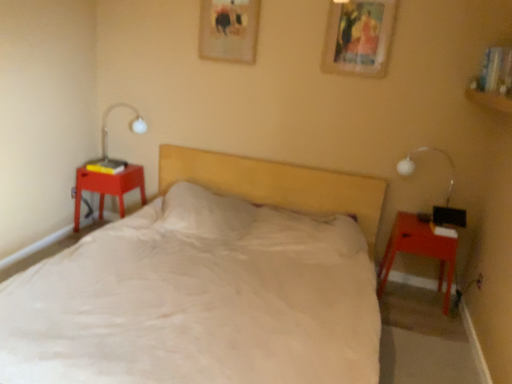
Question: Relative to matte red nightstand at right, which is counted as the 2th nightstand, starting from the back, is matte plastic nightstand at left, which ranks as the first nightstand in left-to-right order, in front or behind?

Choices:
 (A) front
 (B) behind

Answer: (B)

Question: Considering the positions of matte plastic nightstand at left, the 2th nightstand when ordered from right to left, and matte red nightstand at right, marked as the 2th nightstand in a left-to-right arrangement, in the image, is matte plastic nightstand at left, the 2th nightstand when ordered from right to left, bigger or smaller than matte red nightstand at right, marked as the 2th nightstand in a left-to-right arrangement,?

Choices:
 (A) small
 (B) big

Answer: (A)

Question: Estimate the real-world distances between objects in this image. Which object is farther from the white glass bedside lamp at right?

Choices:
 (A) wooden picture frame at upper center, placed as the second picture frame when sorted from left to right
 (B) white soft bed at center
 (C) white glossy table lamp at left
 (D) matte plastic nightstand at left, which ranks as the first nightstand in left-to-right order
 (E) matte red nightstand at right, the first nightstand when ordered from right to left

Answer: (D)

Question: Which object is the closest to the white glossy table lamp at left?

Choices:
 (A) matte plastic nightstand at left, which ranks as the first nightstand in left-to-right order
 (B) wooden picture frame at upper center, arranged as the 2th picture frame when viewed from the back
 (C) white glass bedside lamp at right
 (D) matte red nightstand at right, marked as the 2th nightstand in a left-to-right arrangement
 (E) white soft bed at center

Answer: (A)